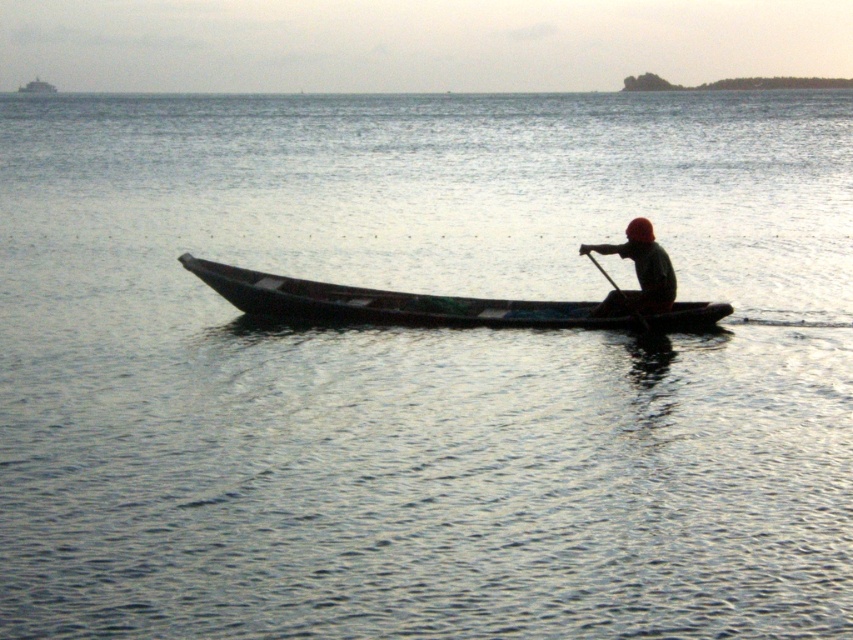
Looking at this image, how much distance is there between dark wood canoe at center and wooden at center?

dark wood canoe at center is 4.07 feet from wooden at center.

Which is below, dark wood canoe at center or wooden at center?

dark wood canoe at center is below.

Is point (492, 323) closer to camera compared to point (630, 316)?

No, (492, 323) is behind (630, 316).

Find the location of a particular element. The image size is (853, 640). dark wood canoe at center is located at coordinates (424, 305).

Can you confirm if dark green fabric at center is wider than wooden at center?

Indeed, dark green fabric at center has a greater width compared to wooden at center.

Does point (625, 228) lie behind point (648, 330)?

Yes, point (625, 228) is farther from viewer.

Is point (642, 232) behind point (636, 314)?

Yes, it is.

At what (x,y) coordinates should I click in order to perform the action: click on dark green fabric at center. Please return your answer as a coordinate pair (x, y). The width and height of the screenshot is (853, 640). Looking at the image, I should click on (637, 273).

Between dark wood canoe at center and dark green fabric at center, which one is positioned lower?

Positioned lower is dark wood canoe at center.

Does dark wood canoe at center have a greater height compared to dark green fabric at center?

Incorrect, dark wood canoe at center's height is not larger of dark green fabric at center's.

Which is in front, point (698, 307) or point (619, 294)?

Point (619, 294) is more forward.

Locate an element on the screen. dark wood canoe at center is located at coordinates (424, 305).